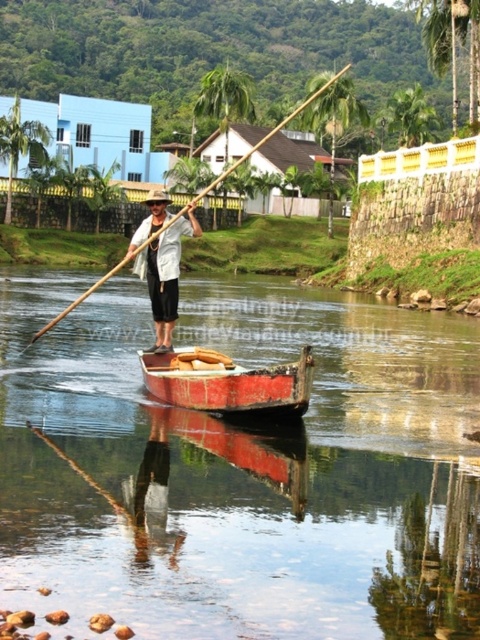
Question: Which object is positioned farthest from the brown wooden paddle at center?

Choices:
 (A) smooth brown water at center
 (B) white matte shirt at center

Answer: (B)

Question: Where is smooth brown water at center located in relation to brown wooden paddle at center in the image?

Choices:
 (A) right
 (B) left

Answer: (B)

Question: Does rusty wood canoe at center appear on the left side of white matte shirt at center?

Choices:
 (A) no
 (B) yes

Answer: (A)

Question: Is smooth brown water at center positioned at the back of white matte shirt at center?

Choices:
 (A) yes
 (B) no

Answer: (B)

Question: Which point is closer to the camera taking this photo?

Choices:
 (A) (417, 467)
 (B) (191, 380)
 (C) (193, 204)

Answer: (A)

Question: Which object is closer to the camera taking this photo?

Choices:
 (A) smooth brown water at center
 (B) brown wooden paddle at center
 (C) white matte shirt at center

Answer: (A)